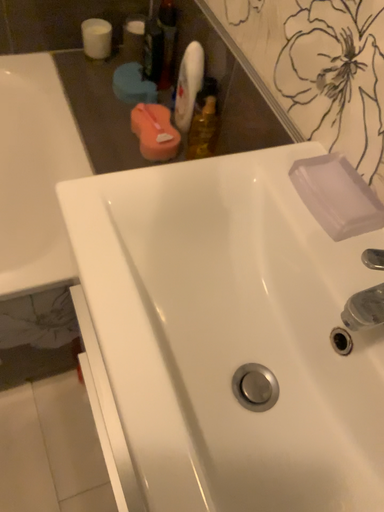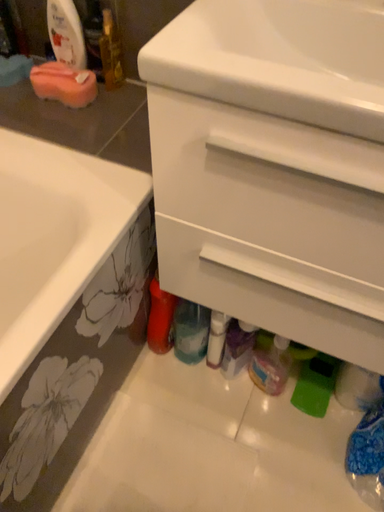
Question: Which way did the camera rotate in the video?

Choices:
 (A) rotated downward
 (B) rotated upward

Answer: (B)